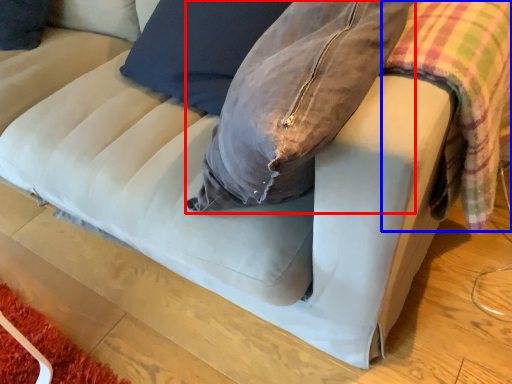
Question: Which object appears closest to the camera in this image, bean bag chair (highlighted by a red box) or plaid (highlighted by a blue box)?

Choices:
 (A) bean bag chair
 (B) plaid

Answer: (B)